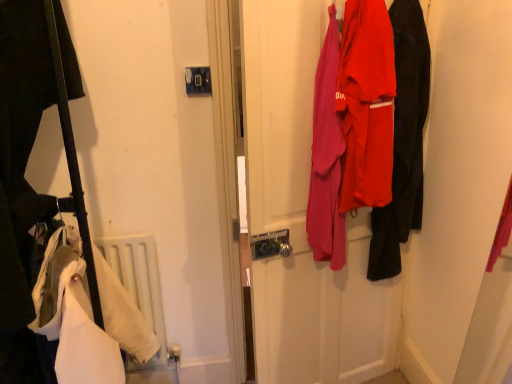
Locate an element on the screen. The height and width of the screenshot is (384, 512). matte black jacket at right is located at coordinates (403, 142).

The height and width of the screenshot is (384, 512). What do you see at coordinates (303, 217) in the screenshot?
I see `matte fabric coats at center` at bounding box center [303, 217].

The image size is (512, 384). Describe the element at coordinates (22, 183) in the screenshot. I see `white fabric at left` at that location.

Identify the location of matte black jacket at right. This screenshot has width=512, height=384. (403, 142).

Does point (106, 258) come closer to viewer compared to point (387, 255)?

Yes.

In terms of height, does white matte radiator at lower left look taller or shorter compared to matte black jacket at right?

white matte radiator at lower left is shorter than matte black jacket at right.

Does white matte radiator at lower left have a lesser width compared to matte black jacket at right?

Indeed, white matte radiator at lower left has a lesser width compared to matte black jacket at right.

Which of these two, matte black jacket at right or white fabric at left, stands taller?

Standing taller between the two is matte black jacket at right.

Which of these two, matte black jacket at right or white fabric at left, is bigger?

Bigger between the two is white fabric at left.

Does matte black jacket at right turn towards white fabric at left?

Yes, matte black jacket at right is turned towards white fabric at left.

Considering the relative sizes of matte black jacket at right and white fabric at left in the image provided, is matte black jacket at right thinner than white fabric at left?

Yes, matte black jacket at right is thinner than white fabric at left.

This screenshot has height=384, width=512. What are the coordinates of `door located above the white matte radiator at lower left (from the image's perspective)` in the screenshot? It's located at [x=303, y=217].

Considering the relative sizes of matte fabric coats at center and white matte radiator at lower left in the image provided, is matte fabric coats at center smaller than white matte radiator at lower left?

No, matte fabric coats at center is not smaller than white matte radiator at lower left.

Considering the relative sizes of matte fabric coats at center and white matte radiator at lower left in the image provided, is matte fabric coats at center shorter than white matte radiator at lower left?

Incorrect, the height of matte fabric coats at center does not fall short of that of white matte radiator at lower left.

How many degrees apart are the facing directions of matte black jacket at right and matte fabric coats at center?

There is a 86.5-degree angle between the facing directions of matte black jacket at right and matte fabric coats at center.

Is matte black jacket at right not within matte fabric coats at center?

No, matte black jacket at right is not outside of matte fabric coats at center.

Find the location of a particular element. clothing that appears on the right of matte fabric coats at center is located at coordinates (403, 142).

Is white matte radiator at lower left closer to camera compared to matte fabric coats at center?

No, white matte radiator at lower left is further to the viewer.

The height and width of the screenshot is (384, 512). Identify the location of radiator that appears below the matte fabric coats at center (from a real-world perspective). (139, 280).

From the image's perspective, is white matte radiator at lower left below matte fabric coats at center?

Yes, from the image's perspective, white matte radiator at lower left is below matte fabric coats at center.

Can you confirm if white matte radiator at lower left is shorter than matte fabric coats at center?

Yes, white matte radiator at lower left is shorter than matte fabric coats at center.

Locate an element on the screen. The image size is (512, 384). clothing on the right of white fabric at left is located at coordinates (403, 142).

Is white fabric at left surrounding matte black jacket at right?

No, matte black jacket at right is not surrounded by white fabric at left.

Who is bigger, white fabric at left or matte black jacket at right?

With larger size is white fabric at left.

Does white fabric at left have a lesser width compared to matte black jacket at right?

Incorrect, the width of white fabric at left is not less than that of matte black jacket at right.

Considering the sizes of objects matte fabric coats at center and white fabric at left in the image provided, who is bigger, matte fabric coats at center or white fabric at left?

white fabric at left is bigger.

Does matte fabric coats at center have a greater height compared to white fabric at left?

Yes.

From the image's perspective, does matte fabric coats at center appear higher than white fabric at left?

Yes, from the image's perspective, matte fabric coats at center is over white fabric at left.

Is matte fabric coats at center aimed at white fabric at left?

No, matte fabric coats at center does not turn towards white fabric at left.

The height and width of the screenshot is (384, 512). Identify the location of radiator behind the matte black jacket at right. (139, 280).

You are a GUI agent. You are given a task and a screenshot of the screen. Output one action in this format:
    pyautogui.click(x=<x>, y=<y>)
    Task: Click on the clothing above the white fabric at left (from a real-world perspective)
    
    Given the screenshot: What is the action you would take?
    pyautogui.click(x=403, y=142)

Considering their positions, is matte black jacket at right positioned closer to white fabric at left than white matte radiator at lower left?

white matte radiator at lower left is positioned closer to the anchor white fabric at left.

Which object lies further to the anchor point white matte radiator at lower left, matte fabric coats at center or white fabric at left?

The object further to white matte radiator at lower left is matte fabric coats at center.

Estimate the real-world distances between objects in this image. Which object is closer to white fabric at left, white matte radiator at lower left or matte fabric coats at center?

white matte radiator at lower left.

Considering their positions, is matte black jacket at right positioned closer to white fabric at left than matte fabric coats at center?

Based on the image, matte fabric coats at center appears to be nearer to white fabric at left.

When comparing their distances from matte black jacket at right, does white matte radiator at lower left or matte fabric coats at center seem closer?

matte fabric coats at center lies closer to matte black jacket at right than the other object.

Considering their positions, is matte fabric coats at center positioned closer to matte black jacket at right than white fabric at left?

matte fabric coats at center lies closer to matte black jacket at right than the other object.

Estimate the real-world distances between objects in this image. Which object is closer to matte fabric coats at center, white fabric at left or matte black jacket at right?

matte black jacket at right is closer to matte fabric coats at center.

Which object lies further to the anchor point matte fabric coats at center, white fabric at left or white matte radiator at lower left?

white fabric at left lies further to matte fabric coats at center than the other object.

Where is `radiator between white fabric at left and matte black jacket at right in the horizontal direction`? radiator between white fabric at left and matte black jacket at right in the horizontal direction is located at coordinates (139, 280).

I want to click on door between white matte radiator at lower left and matte black jacket at right in the horizontal direction, so click(303, 217).

Locate an element on the screen. The height and width of the screenshot is (384, 512). radiator between white fabric at left and matte fabric coats at center in the horizontal direction is located at coordinates (139, 280).

I want to click on door between white fabric at left and matte black jacket at right in the horizontal direction, so click(303, 217).